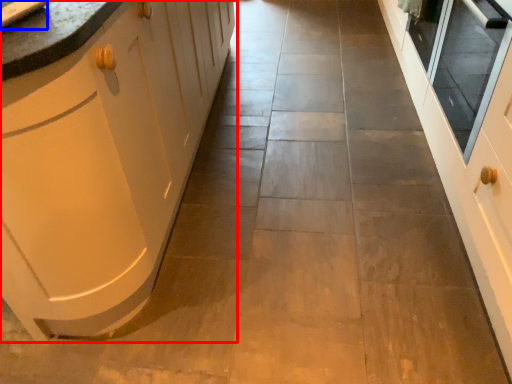
Question: Which of the following is the farthest to the observer, cabinetry (highlighted by a red box) or sink (highlighted by a blue box)?

Choices:
 (A) cabinetry
 (B) sink

Answer: (B)